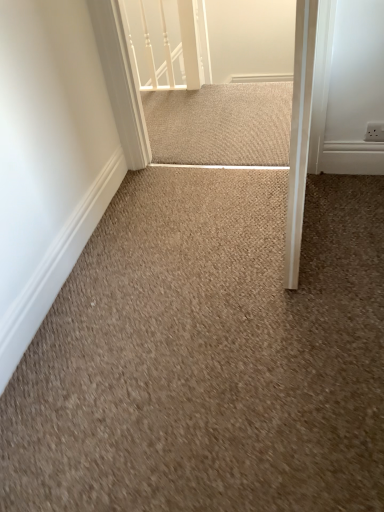
Question: Does white glossy rail at upper center come in front of beige carpet at center?

Choices:
 (A) no
 (B) yes

Answer: (A)

Question: Is beige carpet at center at the back of white glossy rail at upper center?

Choices:
 (A) yes
 (B) no

Answer: (B)

Question: Can you confirm if white glossy rail at upper center is wider than beige carpet at center?

Choices:
 (A) yes
 (B) no

Answer: (B)

Question: Is white glossy rail at upper center to the left of beige carpet at center from the viewer's perspective?

Choices:
 (A) yes
 (B) no

Answer: (A)

Question: Is white glossy rail at upper center thinner than beige carpet at center?

Choices:
 (A) yes
 (B) no

Answer: (A)

Question: Is white glossy rail at upper center at the right side of beige carpet at center?

Choices:
 (A) yes
 (B) no

Answer: (B)

Question: Can you confirm if beige carpet at center is positioned to the left of beige textured mat at center?

Choices:
 (A) yes
 (B) no

Answer: (B)

Question: From a real-world perspective, does beige carpet at center sit lower than beige textured mat at center?

Choices:
 (A) no
 (B) yes

Answer: (B)

Question: Is beige carpet at center looking in the opposite direction of beige textured mat at center?

Choices:
 (A) yes
 (B) no

Answer: (B)

Question: Is beige carpet at center behind beige textured mat at center?

Choices:
 (A) yes
 (B) no

Answer: (B)

Question: Is beige carpet at center bigger than beige textured mat at center?

Choices:
 (A) no
 (B) yes

Answer: (B)

Question: Is beige carpet at center placed right next to beige textured mat at center?

Choices:
 (A) yes
 (B) no

Answer: (B)

Question: Is beige textured mat at center completely or partially outside of beige carpet at center?

Choices:
 (A) no
 (B) yes

Answer: (B)